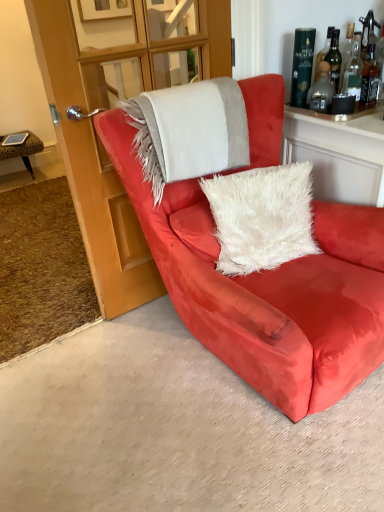
Question: Considering the relative sizes of leopard print fabric stool at left and satin red armchair at center in the image provided, is leopard print fabric stool at left thinner than satin red armchair at center?

Choices:
 (A) no
 (B) yes

Answer: (B)

Question: From a real-world perspective, is leopard print fabric stool at left on satin red armchair at center?

Choices:
 (A) yes
 (B) no

Answer: (B)

Question: From a real-world perspective, is leopard print fabric stool at left below satin red armchair at center?

Choices:
 (A) yes
 (B) no

Answer: (A)

Question: Does leopard print fabric stool at left appear on the left side of satin red armchair at center?

Choices:
 (A) no
 (B) yes

Answer: (B)

Question: Can we say leopard print fabric stool at left lies outside satin red armchair at center?

Choices:
 (A) yes
 (B) no

Answer: (A)

Question: Considering the relative positions of leopard print fabric stool at left and satin red armchair at center in the image provided, is leopard print fabric stool at left in front of satin red armchair at center?

Choices:
 (A) no
 (B) yes

Answer: (A)

Question: Considering the relative sizes of transparent glass door at upper center and green glass bottle at upper right, which is counted as the 1th bottle, starting from the left, in the image provided, is transparent glass door at upper center smaller than green glass bottle at upper right, which is counted as the 1th bottle, starting from the left,?

Choices:
 (A) no
 (B) yes

Answer: (A)

Question: Is transparent glass door at upper center located outside green glass bottle at upper right, which is counted as the 1th bottle, starting from the left?

Choices:
 (A) no
 (B) yes

Answer: (B)

Question: Considering the relative sizes of transparent glass door at upper center and green glass bottle at upper right, which is counted as the 1th bottle, starting from the left, in the image provided, is transparent glass door at upper center thinner than green glass bottle at upper right, which is counted as the 1th bottle, starting from the left,?

Choices:
 (A) yes
 (B) no

Answer: (B)

Question: From the image's perspective, is transparent glass door at upper center beneath green glass bottle at upper right, which is counted as the 1th bottle, starting from the left?

Choices:
 (A) no
 (B) yes

Answer: (B)

Question: Is transparent glass door at upper center at the right side of green glass bottle at upper right, arranged as the third bottle when viewed from the right?

Choices:
 (A) no
 (B) yes

Answer: (A)

Question: Considering the relative sizes of transparent glass door at upper center and green glass bottle at upper right, which is counted as the 1th bottle, starting from the left, in the image provided, is transparent glass door at upper center taller than green glass bottle at upper right, which is counted as the 1th bottle, starting from the left,?

Choices:
 (A) no
 (B) yes

Answer: (B)

Question: Is the depth of transparent glass door at upper center less than that of satin red armchair at center?

Choices:
 (A) yes
 (B) no

Answer: (B)